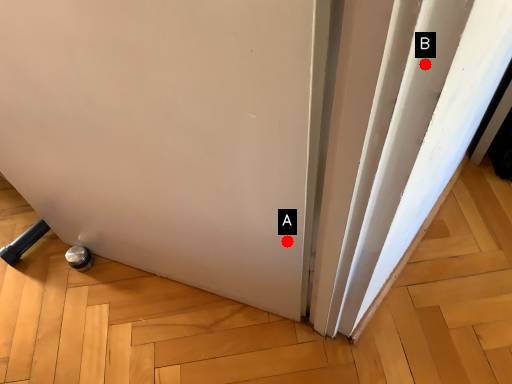
Question: Two points are circled on the image, labeled by A and B beside each circle. Which point is closer to the camera?

Choices:
 (A) A is closer
 (B) B is closer

Answer: (B)